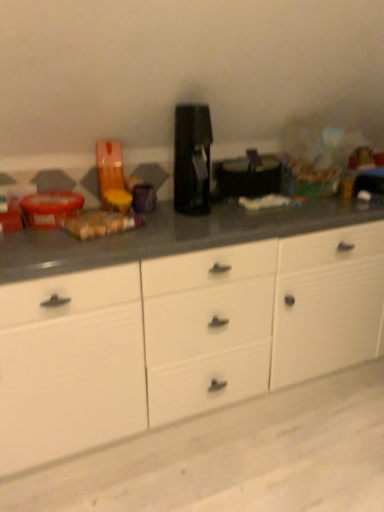
Question: Should I look upward or downward to see white matte cabinet at center?

Choices:
 (A) down
 (B) up

Answer: (A)

Question: Is black plastic coffee machine at center a part of white matte cabinet at center?

Choices:
 (A) yes
 (B) no

Answer: (B)

Question: From the image's perspective, is white matte cabinet at center located beneath black plastic coffee machine at center?

Choices:
 (A) yes
 (B) no

Answer: (A)

Question: Does white matte cabinet at center have a smaller size compared to black plastic coffee machine at center?

Choices:
 (A) no
 (B) yes

Answer: (A)

Question: Is white matte cabinet at center oriented away from black plastic coffee machine at center?

Choices:
 (A) no
 (B) yes

Answer: (A)

Question: Considering the relative sizes of white matte cabinet at center and black plastic coffee machine at center in the image provided, is white matte cabinet at center thinner than black plastic coffee machine at center?

Choices:
 (A) yes
 (B) no

Answer: (B)

Question: Considering the relative sizes of white matte cabinet at center and black plastic coffee machine at center in the image provided, is white matte cabinet at center taller than black plastic coffee machine at center?

Choices:
 (A) yes
 (B) no

Answer: (A)

Question: Can you confirm if black plastic coffee machine at center is positioned to the left of white matte cabinet at center?

Choices:
 (A) yes
 (B) no

Answer: (A)

Question: Could you tell me if black plastic coffee machine at center is facing white matte cabinet at center?

Choices:
 (A) no
 (B) yes

Answer: (A)

Question: Is white matte cabinet at center at the back of black plastic coffee machine at center?

Choices:
 (A) no
 (B) yes

Answer: (A)

Question: Is black plastic coffee machine at center touching white matte cabinet at center?

Choices:
 (A) no
 (B) yes

Answer: (A)

Question: Is the position of black plastic coffee machine at center less distant than that of white matte cabinet at center?

Choices:
 (A) yes
 (B) no

Answer: (B)

Question: From a real-world perspective, is black plastic coffee machine at center located beneath white matte cabinet at center?

Choices:
 (A) no
 (B) yes

Answer: (A)

Question: Considering the positions of point (182, 196) and point (281, 295), is point (182, 196) closer or farther from the camera than point (281, 295)?

Choices:
 (A) closer
 (B) farther

Answer: (B)